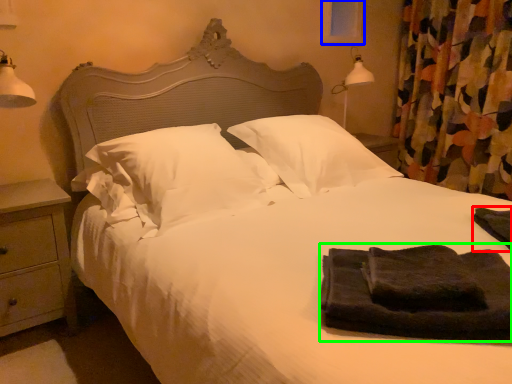
Question: Which is farther away from material (highlighted by a red box)? window screen (highlighted by a blue box) or material (highlighted by a green box)?

Choices:
 (A) window screen
 (B) material

Answer: (A)